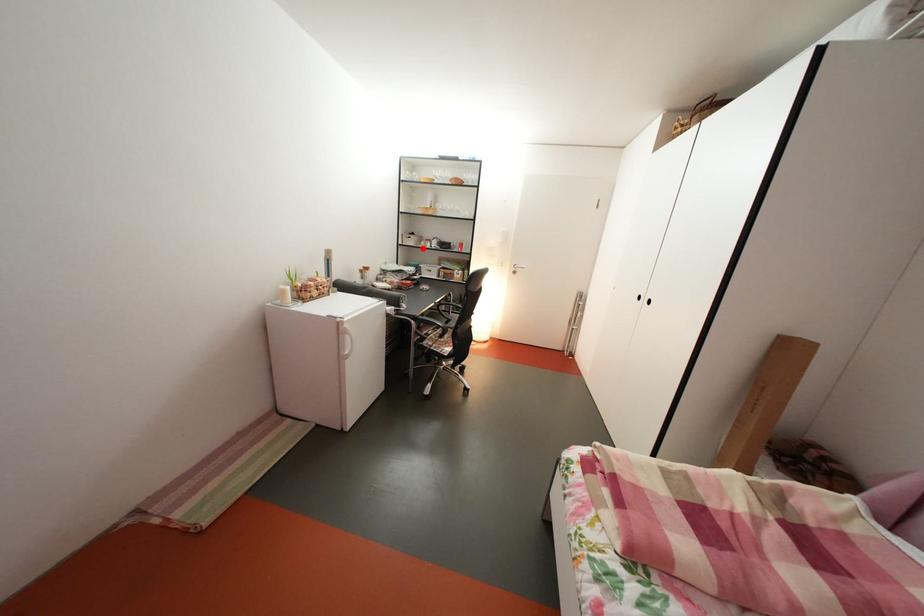
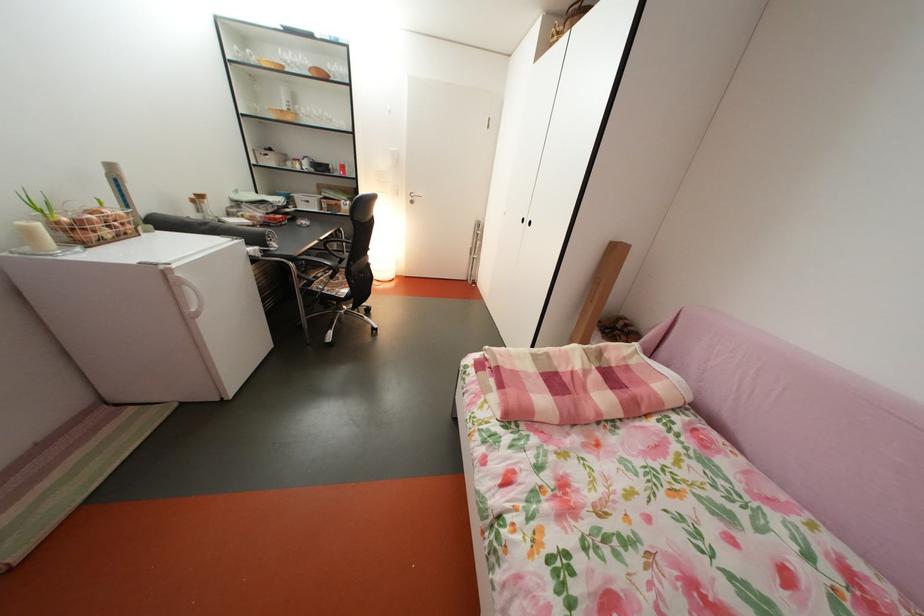
In the second image, find the point that corresponds to the highlighted location in the first image.

(283, 168)